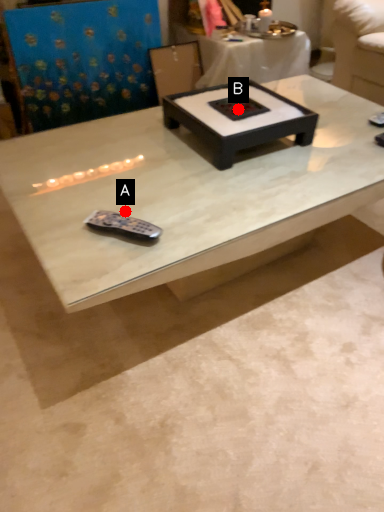
Question: Two points are circled on the image, labeled by A and B beside each circle. Which of the following is the closest to the observer?

Choices:
 (A) A is closer
 (B) B is closer

Answer: (A)